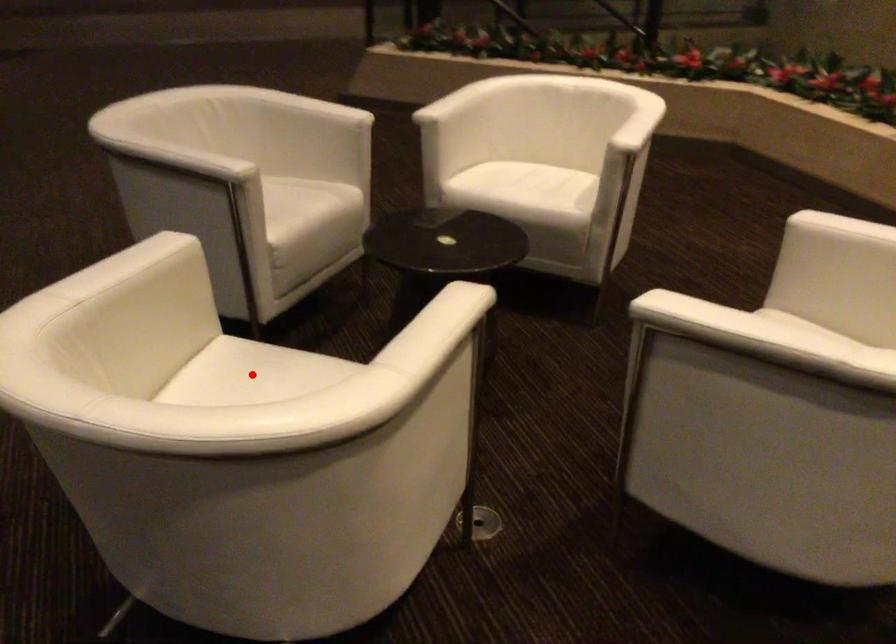
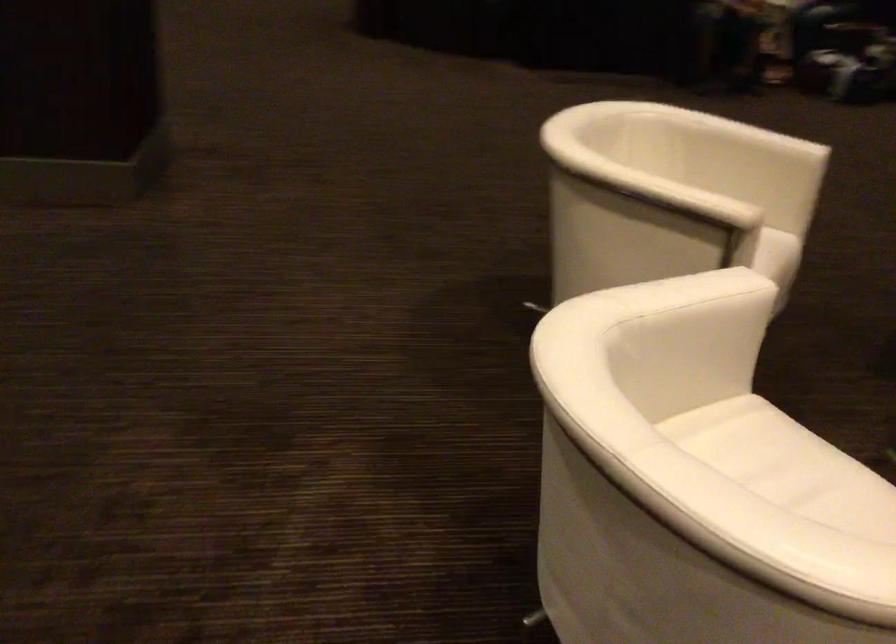
Question: I am providing you with two images of the same scene from different viewpoints. A red point is marked on the first image. Is the red point's position out of view in image 2?

Choices:
 (A) Yes
 (B) No

Answer: (A)